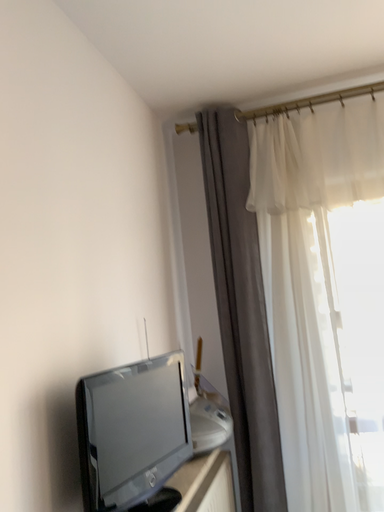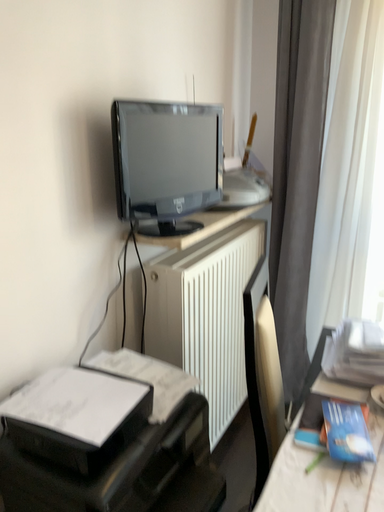
Question: How did the camera likely rotate when shooting the video?

Choices:
 (A) rotated upward
 (B) rotated downward

Answer: (B)